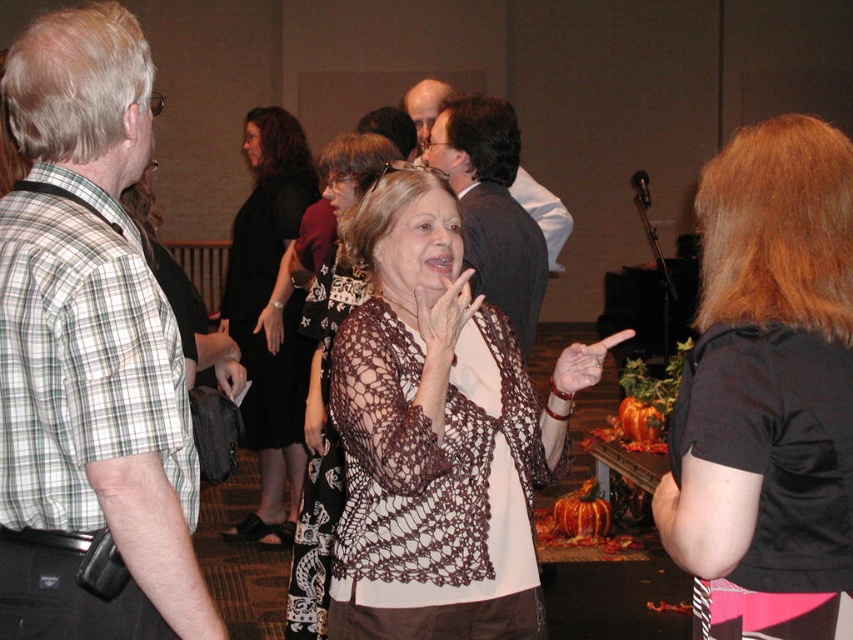
Does black fabric shirt at right have a larger size compared to black lace shawl at center?

No, black fabric shirt at right is not bigger than black lace shawl at center.

Where is `black fabric shirt at right`? The height and width of the screenshot is (640, 853). black fabric shirt at right is located at coordinates (767, 390).

Can you confirm if black fabric shirt at right is positioned to the right of white lace glove at center?

Indeed, black fabric shirt at right is positioned on the right side of white lace glove at center.

Does black fabric shirt at right appear on the left side of white lace glove at center?

Incorrect, black fabric shirt at right is not on the left side of white lace glove at center.

Is point (813, 273) positioned in front of point (274, 316)?

Yes, point (813, 273) is in front of point (274, 316).

The width and height of the screenshot is (853, 640). What are the coordinates of `black fabric shirt at right` in the screenshot? It's located at (767, 390).

Is white lace hand at center further to the viewer compared to smooth bald head at center?

No.

Who is higher up, white lace hand at center or smooth bald head at center?

smooth bald head at center is higher up.

Describe the element at coordinates (444, 316) in the screenshot. I see `white lace hand at center` at that location.

You are a GUI agent. You are given a task and a screenshot of the screen. Output one action in this format:
    pyautogui.click(x=<x>, y=<y>)
    Task: Click on the white lace hand at center
    This screenshot has width=853, height=640.
    Given the screenshot: What is the action you would take?
    pyautogui.click(x=444, y=316)